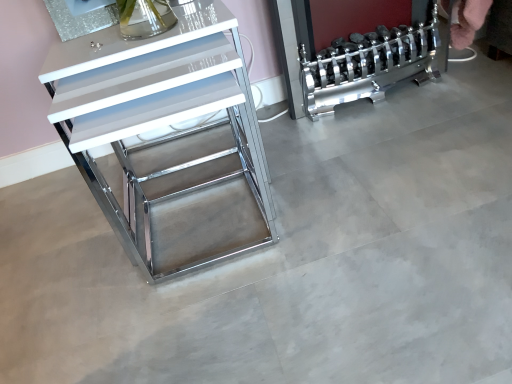
Find the location of a particular element. This screenshot has height=384, width=512. free area in between white glossy drawer at left and chrome metallic dumbbell rack at right is located at coordinates (343, 142).